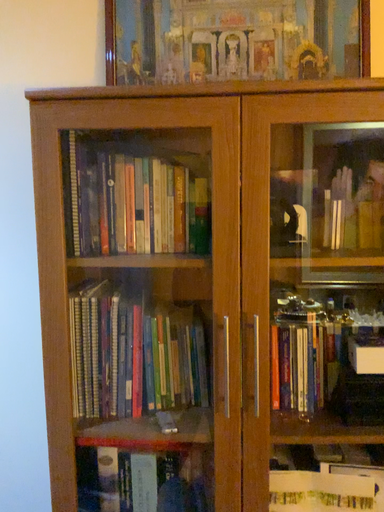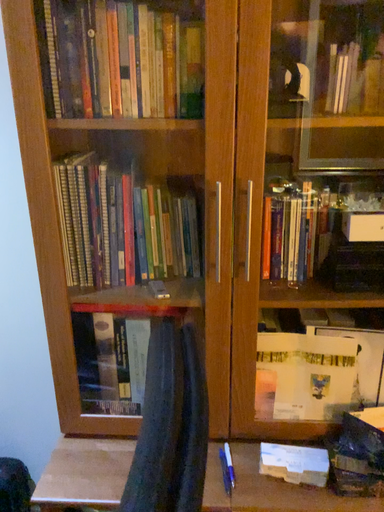
Question: Which way did the camera rotate in the video?

Choices:
 (A) rotated downward
 (B) rotated upward

Answer: (A)